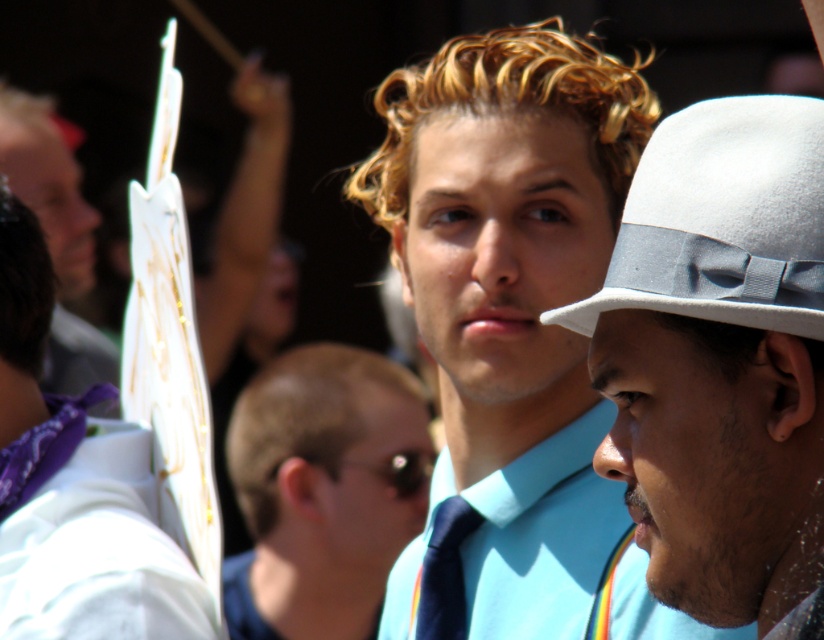
Question: Which object is the closest to the matte blue shirt at center?

Choices:
 (A) white felt fedora at right
 (B) white felt fedora at upper center
 (C) white paper sign at upper left
 (D) dark blue silk tie at center

Answer: (D)

Question: Does matte blue shirt at center appear on the left side of dark blue silk tie at center?

Choices:
 (A) yes
 (B) no

Answer: (B)

Question: Can you confirm if light brown hair at center is bigger than white felt fedora at upper center?

Choices:
 (A) yes
 (B) no

Answer: (A)

Question: Is light brown hair at center thinner than matte white sign at left?

Choices:
 (A) no
 (B) yes

Answer: (B)

Question: Which of the following is the farthest from the observer?

Choices:
 (A) (424, 632)
 (B) (813, 129)

Answer: (A)

Question: Which point appears closest to the camera in this image?

Choices:
 (A) (721, 147)
 (B) (340, 484)
 (C) (464, 518)

Answer: (A)